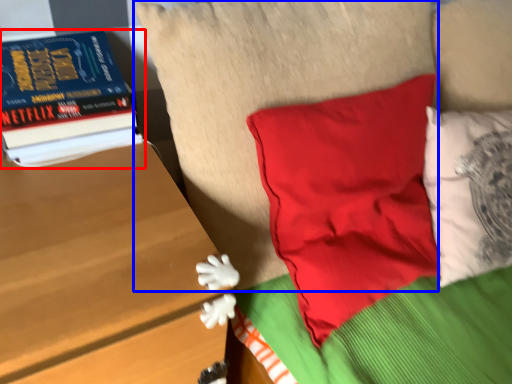
Question: Which object is closer to the camera taking this photo, book (highlighted by a red box) or pillow (highlighted by a blue box)?

Choices:
 (A) book
 (B) pillow

Answer: (B)